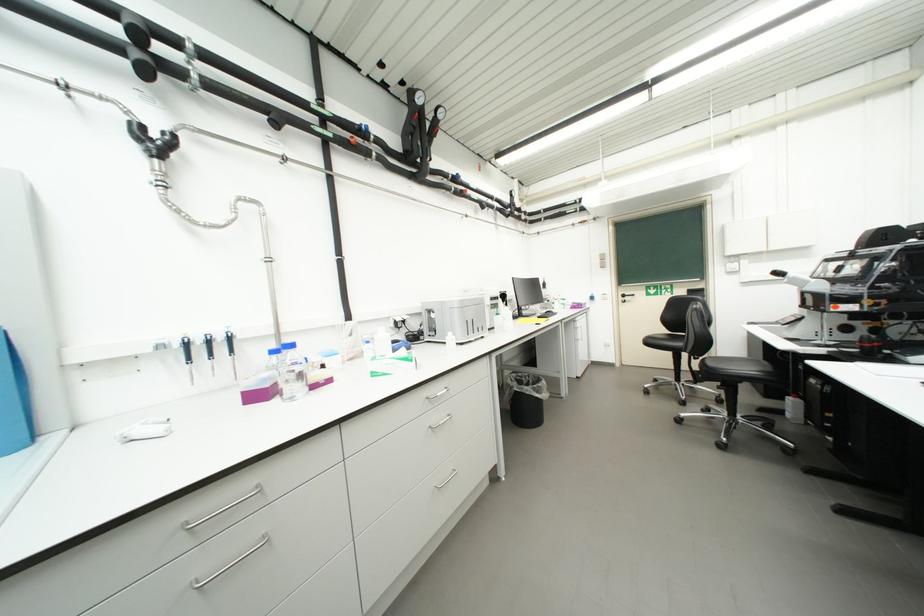
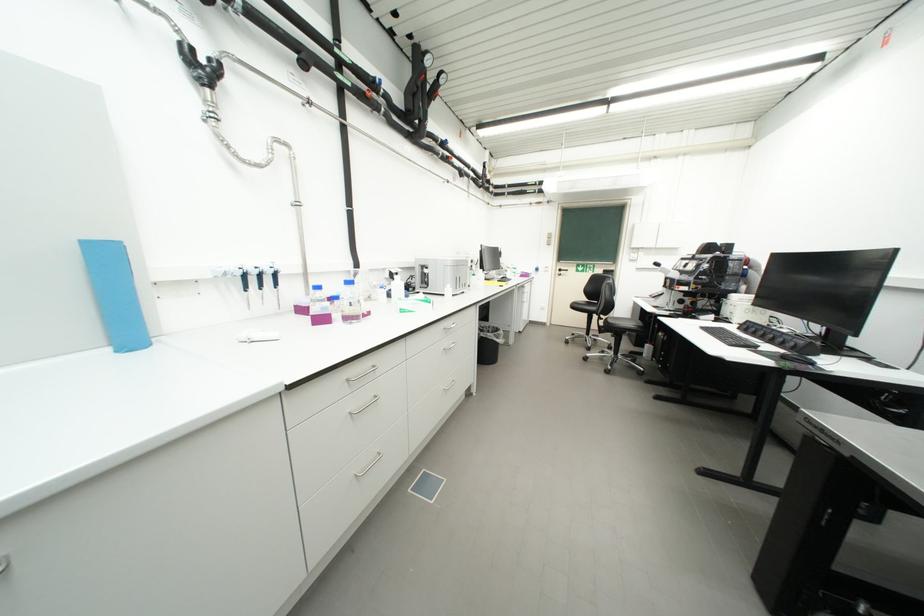
The point at (703, 369) is marked in the first image. Where is the corresponding point in the second image?

(610, 325)